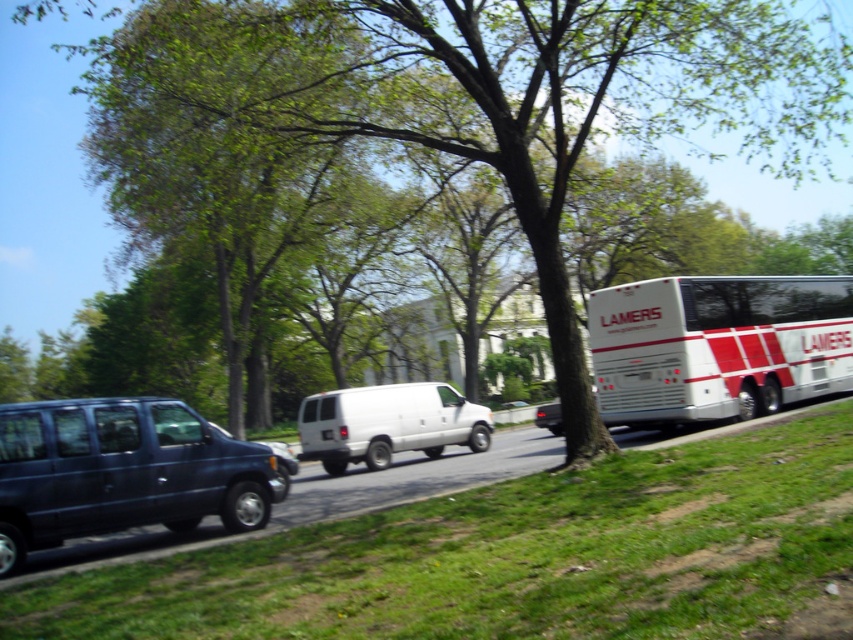
Question: Which of these objects is positioned farthest from the white/red striped bus at right?

Choices:
 (A) matte black van at left
 (B) green leafy tree at center

Answer: (B)

Question: Which point is closer to the camera?

Choices:
 (A) green leafy tree at center
 (B) white/red striped bus at right
 (C) matte black van at left
 (D) white matte van at center

Answer: (C)

Question: Does matte black van at left have a greater width compared to white matte van at center?

Choices:
 (A) no
 (B) yes

Answer: (A)

Question: Estimate the real-world distances between objects in this image. Which object is closer to the white matte van at center?

Choices:
 (A) white/red striped bus at right
 (B) green leafy tree at center
 (C) matte black van at left

Answer: (A)

Question: Does green leafy tree at center come behind white/red striped bus at right?

Choices:
 (A) yes
 (B) no

Answer: (B)

Question: In this image, where is white/red striped bus at right located relative to matte black van at left?

Choices:
 (A) below
 (B) above

Answer: (B)